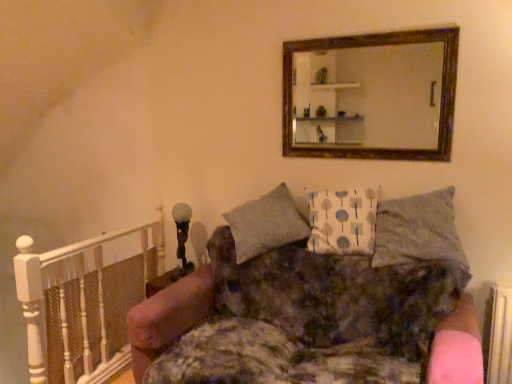
Question: In terms of height, does white painted wood balustrade at left look taller or shorter compared to velvet floral couch at center?

Choices:
 (A) tall
 (B) short

Answer: (B)

Question: Considering the positions of point click(104, 291) and point click(198, 276), is point click(104, 291) closer or farther from the camera than point click(198, 276)?

Choices:
 (A) farther
 (B) closer

Answer: (A)

Question: Based on their relative distances, which object is farther from the textured gray pillow at upper right, acting as the 2th pillow starting from the left?

Choices:
 (A) wooden frame mirror at upper center
 (B) white painted wood balustrade at left
 (C) velvet floral couch at center
 (D) white fabric pillow at center, which appears as the 2th pillow when viewed from the right

Answer: (B)

Question: Estimate the real-world distances between objects in this image. Which object is closer to the textured gray pillow at upper right, marked as the first pillow in a right-to-left arrangement?

Choices:
 (A) velvet floral couch at center
 (B) white fabric pillow at center, which appears as the 2th pillow when viewed from the right
 (C) wooden frame mirror at upper center
 (D) white painted wood balustrade at left

Answer: (B)